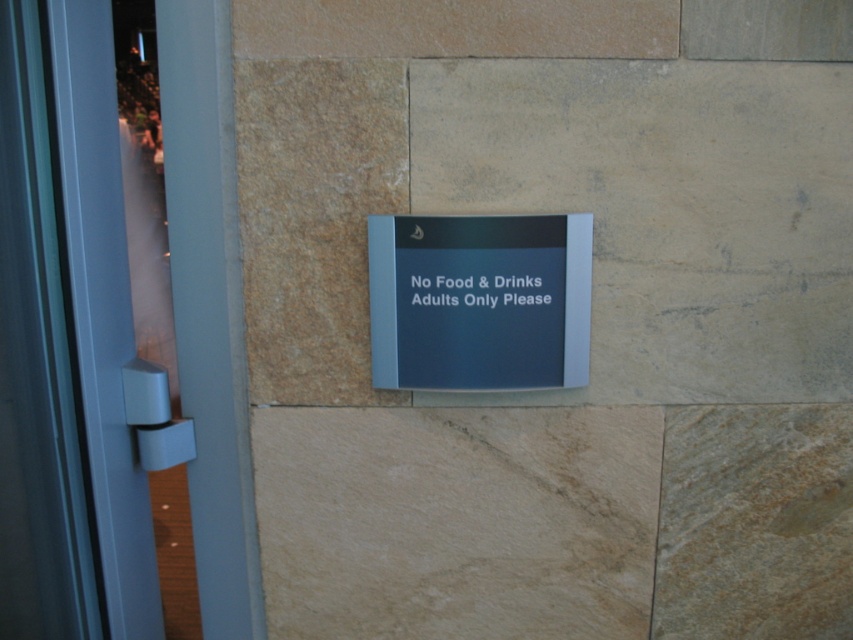
Is blue plastic sign at center taller than black plastic sign at center?

Yes.

I want to click on blue plastic sign at center, so click(479, 301).

At what (x,y) coordinates should I click in order to perform the action: click on blue plastic sign at center. Please return your answer as a coordinate pair (x, y). The image size is (853, 640). Looking at the image, I should click on (479, 301).

Is point (177, 160) farther from viewer compared to point (502, 355)?

Yes, point (177, 160) is behind point (502, 355).

Does transparent glass door at center appear under blue plastic sign at center?

Yes.

This screenshot has width=853, height=640. What do you see at coordinates (109, 332) in the screenshot?
I see `transparent glass door at center` at bounding box center [109, 332].

Where is `transparent glass door at center`? transparent glass door at center is located at coordinates (109, 332).

Is transparent glass door at center above black plastic sign at center?

Incorrect, transparent glass door at center is not positioned above black plastic sign at center.

Who is higher up, transparent glass door at center or black plastic sign at center?

black plastic sign at center is above.

Is point (3, 536) positioned after point (514, 282)?

That is True.

Where is `transparent glass door at center`? This screenshot has width=853, height=640. transparent glass door at center is located at coordinates (109, 332).